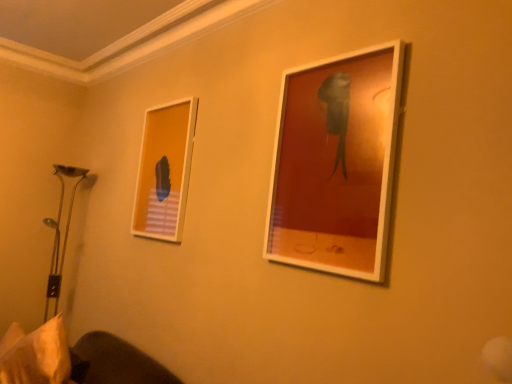
This screenshot has height=384, width=512. What do you see at coordinates (35, 355) in the screenshot? I see `white fabric pillow at lower left` at bounding box center [35, 355].

Find the location of `white fabric pillow at lower left`. white fabric pillow at lower left is located at coordinates (35, 355).

Measure the distance from white fabric pillow at lower left to matte white picture frame at upper left, the second picture frame in the right-to-left sequence.

90.83 centimeters.

You are a GUI agent. You are given a task and a screenshot of the screen. Output one action in this format:
    pyautogui.click(x=<x>, y=<y>)
    Task: Click on the pillow on the left of matte white picture frame at upper left, the second picture frame in the right-to-left sequence
    This screenshot has width=512, height=384.
    Given the screenshot: What is the action you would take?
    point(35,355)

Is the depth of white fabric pillow at lower left greater than that of matte white picture frame at upper left, the 2th picture frame from the front?

No, white fabric pillow at lower left is in front of matte white picture frame at upper left, the 2th picture frame from the front.

From a real-world perspective, between white fabric pillow at lower left and matte white picture frame at upper left, marked as the first picture frame in a left-to-right arrangement, who is vertically lower?

In real-world perspective, white fabric pillow at lower left is lower.

How different are the orientations of matte white picture frame at upper right, positioned as the second picture frame in left-to-right order, and matte white picture frame at upper left, marked as the first picture frame in a left-to-right arrangement, in degrees?

The angular difference between matte white picture frame at upper right, positioned as the second picture frame in left-to-right order, and matte white picture frame at upper left, marked as the first picture frame in a left-to-right arrangement, is 0.00464 degrees.

Is matte white picture frame at upper right, which appears as the second picture frame when viewed from the back, not close to matte white picture frame at upper left, the first picture frame when ordered from back to front?

They are positioned close to each other.

Who is smaller, matte white picture frame at upper right, marked as the first picture frame in a right-to-left arrangement, or matte white picture frame at upper left, the 2th picture frame from the front?

matte white picture frame at upper left, the 2th picture frame from the front, is smaller.

From a real-world perspective, is matte white picture frame at upper right, positioned as the second picture frame in left-to-right order, physically above matte white picture frame at upper left, marked as the first picture frame in a left-to-right arrangement?

Indeed, from a real-world perspective, matte white picture frame at upper right, positioned as the second picture frame in left-to-right order, stands above matte white picture frame at upper left, marked as the first picture frame in a left-to-right arrangement.

Is white fabric pillow at lower left positioned with its back to matte white picture frame at upper right, which appears as the second picture frame when viewed from the back?

white fabric pillow at lower left does not have its back to matte white picture frame at upper right, which appears as the second picture frame when viewed from the back.

In terms of size, does white fabric pillow at lower left appear bigger or smaller than matte white picture frame at upper right, which appears as the second picture frame when viewed from the back?

In the image, white fabric pillow at lower left appears to be larger than matte white picture frame at upper right, which appears as the second picture frame when viewed from the back.

Who is more distant, white fabric pillow at lower left or matte white picture frame at upper right, marked as the first picture frame in a front-to-back arrangement?

Positioned behind is white fabric pillow at lower left.

Is matte white picture frame at upper right, positioned as the second picture frame in left-to-right order, located within white fabric pillow at lower left?

No.

Between point (193, 104) and point (24, 383), which one is positioned behind?

The point (193, 104) is farther from the camera.

Is the position of matte white picture frame at upper left, marked as the first picture frame in a left-to-right arrangement, less distant than that of white fabric pillow at lower left?

No, matte white picture frame at upper left, marked as the first picture frame in a left-to-right arrangement, is behind white fabric pillow at lower left.

Can you tell me how much matte white picture frame at upper left, the first picture frame when ordered from back to front, and white fabric pillow at lower left differ in facing direction?

21.8 degrees separate the facing orientations of matte white picture frame at upper left, the first picture frame when ordered from back to front, and white fabric pillow at lower left.

In the scene shown: Considering the sizes of objects matte white picture frame at upper left, the first picture frame when ordered from back to front, and white fabric pillow at lower left in the image provided, who is shorter, matte white picture frame at upper left, the first picture frame when ordered from back to front, or white fabric pillow at lower left?

With less height is white fabric pillow at lower left.

How different are the orientations of matte white picture frame at upper left, the first picture frame when ordered from back to front, and matte white picture frame at upper right, which appears as the second picture frame when viewed from the back, in degrees?

0.00464 degrees.

Which is correct: matte white picture frame at upper left, the 2th picture frame from the front, is inside matte white picture frame at upper right, which appears as the second picture frame when viewed from the back, or outside of it?

matte white picture frame at upper left, the 2th picture frame from the front, is not inside matte white picture frame at upper right, which appears as the second picture frame when viewed from the back, it's outside.

This screenshot has width=512, height=384. Find the location of `picture frame above the matte white picture frame at upper right, positioned as the second picture frame in left-to-right order (from the image's perspective)`. picture frame above the matte white picture frame at upper right, positioned as the second picture frame in left-to-right order (from the image's perspective) is located at coordinates (165, 170).

Is point (179, 178) positioned before point (362, 217)?

No, it is not.

Looking at this image, how far apart are matte white picture frame at upper right, positioned as the second picture frame in left-to-right order, and white fabric pillow at lower left?

1.37 meters.

Identify the location of pillow on the left side of matte white picture frame at upper right, which appears as the second picture frame when viewed from the back. (35, 355).

From the image's perspective, is matte white picture frame at upper right, marked as the first picture frame in a front-to-back arrangement, beneath white fabric pillow at lower left?

No, from the image's perspective, matte white picture frame at upper right, marked as the first picture frame in a front-to-back arrangement, is not beneath white fabric pillow at lower left.

Considering the relative sizes of matte white picture frame at upper right, marked as the first picture frame in a right-to-left arrangement, and white fabric pillow at lower left in the image provided, is matte white picture frame at upper right, marked as the first picture frame in a right-to-left arrangement, thinner than white fabric pillow at lower left?

Yes, matte white picture frame at upper right, marked as the first picture frame in a right-to-left arrangement, is thinner than white fabric pillow at lower left.

Find the location of `pillow that is under the matte white picture frame at upper left, the 2th picture frame from the front (from a real-world perspective)`. pillow that is under the matte white picture frame at upper left, the 2th picture frame from the front (from a real-world perspective) is located at coordinates (35, 355).

At what (x,y) coordinates should I click in order to perform the action: click on picture frame to the left of matte white picture frame at upper right, which appears as the second picture frame when viewed from the back. Please return your answer as a coordinate pair (x, y). Looking at the image, I should click on (165, 170).

From the image, which object appears to be nearer to white fabric pillow at lower left, matte white picture frame at upper left, marked as the first picture frame in a left-to-right arrangement, or matte white picture frame at upper right, positioned as the second picture frame in left-to-right order?

Among the two, matte white picture frame at upper left, marked as the first picture frame in a left-to-right arrangement, is located nearer to white fabric pillow at lower left.

Estimate the real-world distances between objects in this image. Which object is further from matte white picture frame at upper right, positioned as the second picture frame in left-to-right order, matte white picture frame at upper left, the first picture frame when ordered from back to front, or white fabric pillow at lower left?

white fabric pillow at lower left.

Looking at the image, which one is located further to matte white picture frame at upper left, the 2th picture frame from the front, white fabric pillow at lower left or matte white picture frame at upper right, marked as the first picture frame in a right-to-left arrangement?

matte white picture frame at upper right, marked as the first picture frame in a right-to-left arrangement, lies further to matte white picture frame at upper left, the 2th picture frame from the front, than the other object.

Based on their spatial positions, is white fabric pillow at lower left or matte white picture frame at upper left, the first picture frame when ordered from back to front, further from matte white picture frame at upper right, marked as the first picture frame in a front-to-back arrangement?

white fabric pillow at lower left lies further to matte white picture frame at upper right, marked as the first picture frame in a front-to-back arrangement, than the other object.

From the image, which object appears to be farther from matte white picture frame at upper left, the second picture frame in the right-to-left sequence, matte white picture frame at upper right, which appears as the second picture frame when viewed from the back, or white fabric pillow at lower left?

The object further to matte white picture frame at upper left, the second picture frame in the right-to-left sequence, is matte white picture frame at upper right, which appears as the second picture frame when viewed from the back.

Which object lies nearer to the anchor point white fabric pillow at lower left, matte white picture frame at upper right, marked as the first picture frame in a right-to-left arrangement, or matte white picture frame at upper left, marked as the first picture frame in a left-to-right arrangement?

Based on the image, matte white picture frame at upper left, marked as the first picture frame in a left-to-right arrangement, appears to be nearer to white fabric pillow at lower left.

Find the location of a particular element. picture frame situated between white fabric pillow at lower left and matte white picture frame at upper right, positioned as the second picture frame in left-to-right order, from left to right is located at coordinates (165, 170).